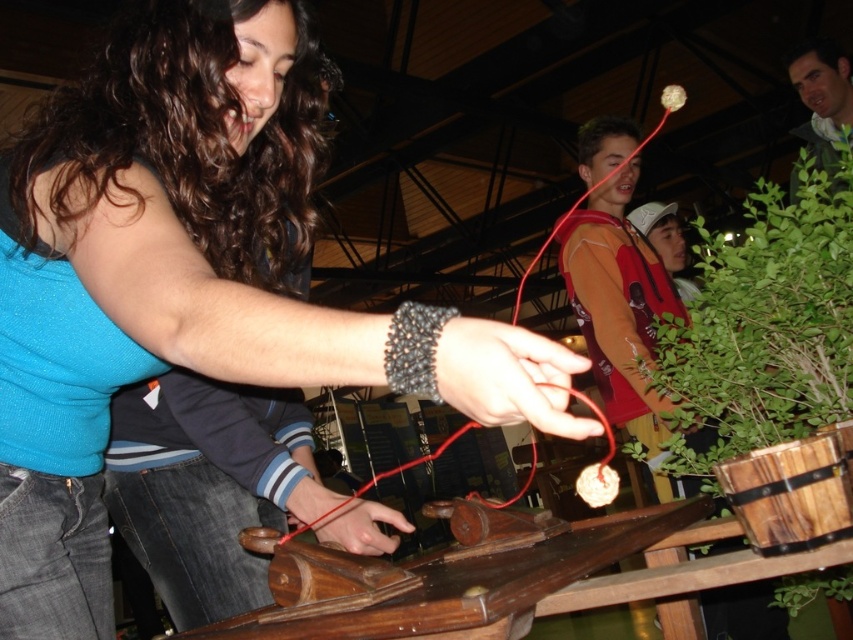
Question: Does matte blue shirt at center appear on the right side of green leafy plant at right?

Choices:
 (A) no
 (B) yes

Answer: (A)

Question: Which object appears closest to the camera in this image?

Choices:
 (A) green leafy plant at right
 (B) matte blue shirt at center

Answer: (B)

Question: Observing the image, what is the correct spatial positioning of matte blue shirt at center in reference to green leafy plant at right?

Choices:
 (A) below
 (B) above

Answer: (A)

Question: Which point is farther to the camera?

Choices:
 (A) green leafy plant at right
 (B) matte blue shirt at center

Answer: (A)

Question: From the image, what is the correct spatial relationship of matte blue shirt at center in relation to green leafy plant at right?

Choices:
 (A) above
 (B) below

Answer: (B)

Question: Which object is closer to the camera taking this photo?

Choices:
 (A) green leafy plant at right
 (B) matte blue shirt at center

Answer: (B)